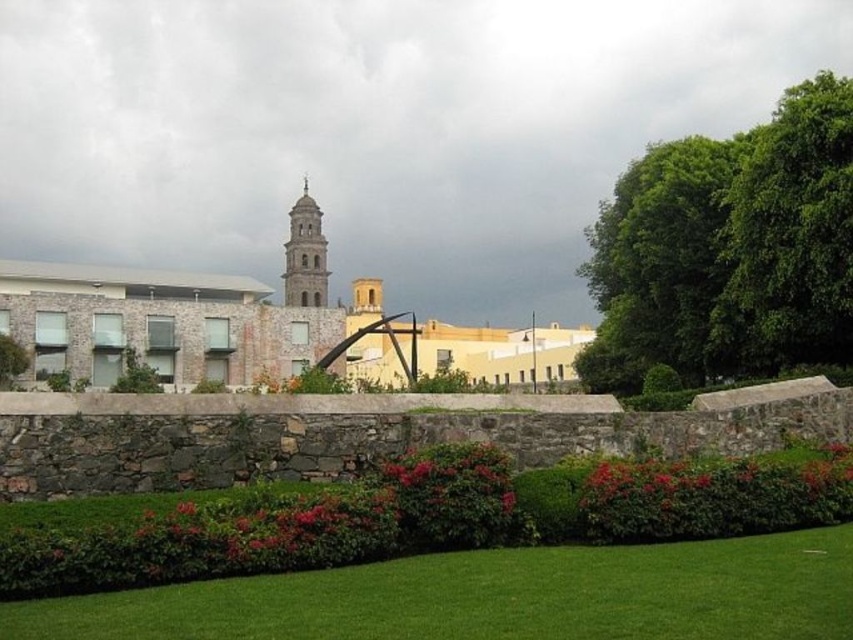
Question: Considering the real-world distances, which object is closest to the green leafy tree at upper right?

Choices:
 (A) green grass at lower center
 (B) smooth stone bell tower at center

Answer: (A)

Question: Among these objects, which one is nearest to the camera?

Choices:
 (A) green grass at lower center
 (B) green leafy tree at upper right
 (C) smooth stone bell tower at center

Answer: (A)

Question: Is green leafy tree at upper right smaller than smooth stone bell tower at center?

Choices:
 (A) yes
 (B) no

Answer: (A)

Question: Is green grass at lower center in front of smooth stone bell tower at center?

Choices:
 (A) yes
 (B) no

Answer: (A)

Question: Which point is farther to the camera?

Choices:
 (A) (201, 596)
 (B) (718, 326)
 (C) (302, 301)

Answer: (C)

Question: Does green leafy tree at upper right appear on the right side of smooth stone bell tower at center?

Choices:
 (A) no
 (B) yes

Answer: (B)